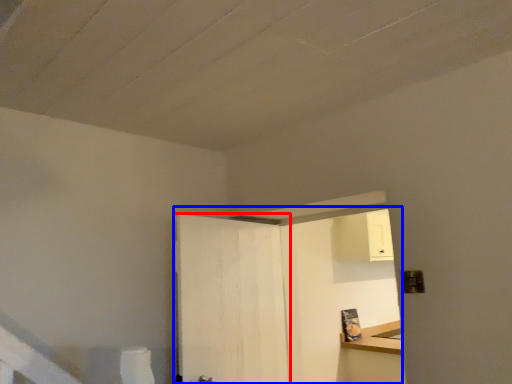
Question: Which point is further to the camera, door (highlighted by a red box) or dresser (highlighted by a blue box)?

Choices:
 (A) door
 (B) dresser

Answer: (B)